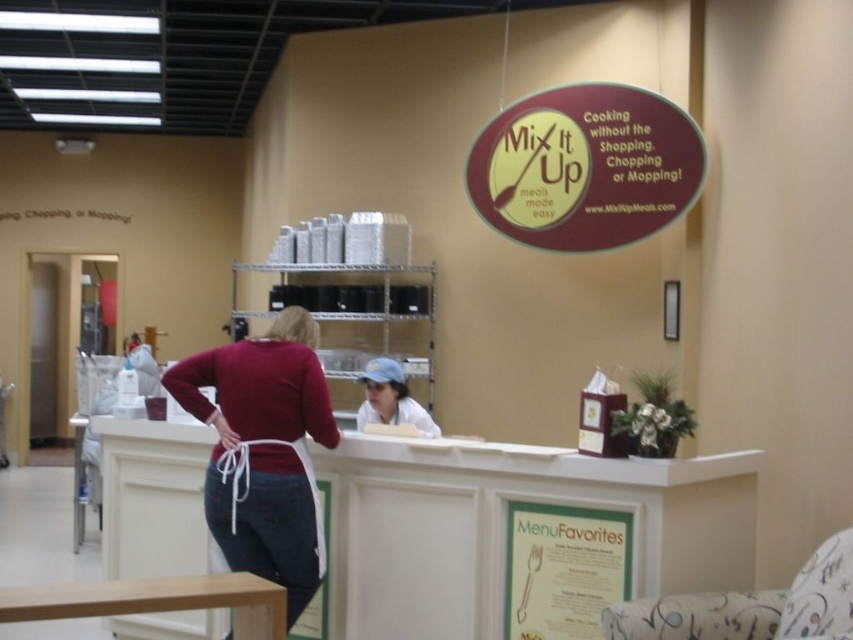
Between white glossy counter at center and matte white apron at center, which one is positioned higher?

Positioned higher is matte white apron at center.

Does white glossy counter at center have a greater width compared to matte white apron at center?

Indeed, white glossy counter at center has a greater width compared to matte white apron at center.

This screenshot has width=853, height=640. I want to click on white glossy counter at center, so click(520, 531).